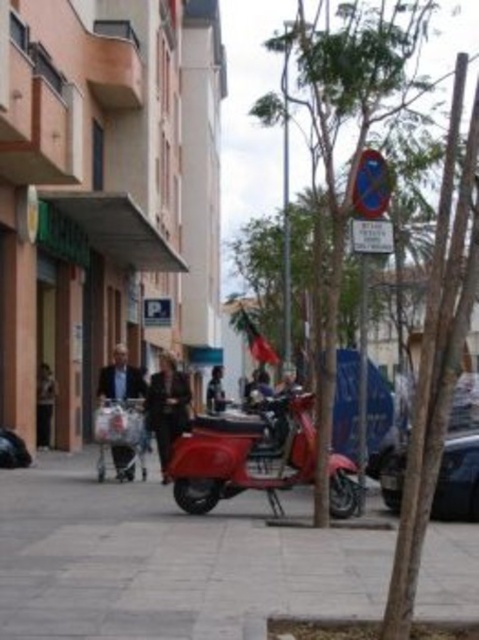
You are a delivery driver who needs to park your 6.5 feet long delivery van between the metallic red scooter at center and the shiny black car at right. Can you safely park your van there without overlapping either vehicle?

The distance between the metallic red scooter at center and the shiny black car at right is 6.64 feet. Since your delivery van is 6.5 feet long, it can fit in the space as there is enough room. However, you must ensure precise positioning to avoid overlapping either vehicle.

What is located at the coordinates point (166, 561) in the image?

The gray concrete pavement at center is located at point (166, 561).